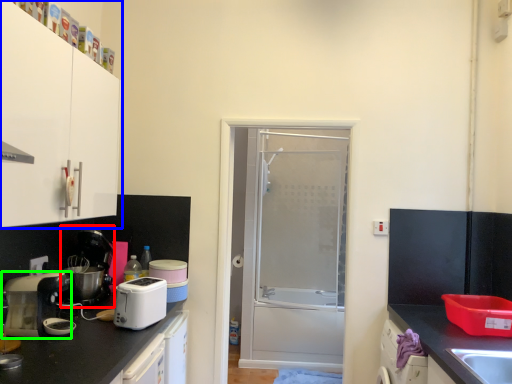
Question: Which is nearer to the coffee machine (highlighted by a red box)? cabinetry (highlighted by a blue box) or home appliance (highlighted by a green box).

Choices:
 (A) cabinetry
 (B) home appliance

Answer: (B)